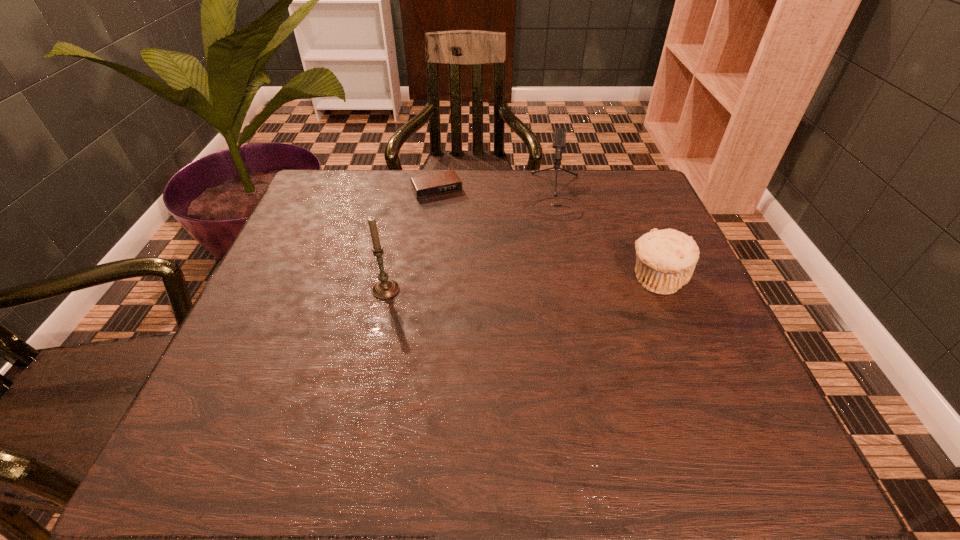
In the image, there is a desktop. What are the coordinates of `vacant space at the far right corner` in the screenshot? It's located at (628, 206).

Where is `free space at the near right corner`? The height and width of the screenshot is (540, 960). free space at the near right corner is located at coordinates coord(665,407).

Locate an element on the screen. This screenshot has width=960, height=540. unoccupied area between the tallest object and the alarm clock is located at coordinates (411, 240).

Where is `vacant area that lies between the candle and the muffin`? The image size is (960, 540). vacant area that lies between the candle and the muffin is located at coordinates (521, 285).

Where is `free space that is in between the third object from left to right and the muffin`? This screenshot has height=540, width=960. free space that is in between the third object from left to right and the muffin is located at coordinates (605, 237).

Where is `free space between the third tallest object and the third object from left to right`? This screenshot has width=960, height=540. free space between the third tallest object and the third object from left to right is located at coordinates (605, 237).

Find the location of a particular element. free spot between the shortest object and the candle is located at coordinates (411, 240).

In order to click on vacant space in between the microphone and the muffin in this screenshot , I will do `click(605, 237)`.

At what (x,y) coordinates should I click in order to perform the action: click on free space that is in between the alarm clock and the candle. Please return your answer as a coordinate pair (x, y). This screenshot has width=960, height=540. Looking at the image, I should click on (411, 240).

You are a GUI agent. You are given a task and a screenshot of the screen. Output one action in this format:
    pyautogui.click(x=<x>, y=<y>)
    Task: Click on the vacant area between the shortest object and the rightmost object
    The width and height of the screenshot is (960, 540).
    Given the screenshot: What is the action you would take?
    pyautogui.click(x=546, y=235)